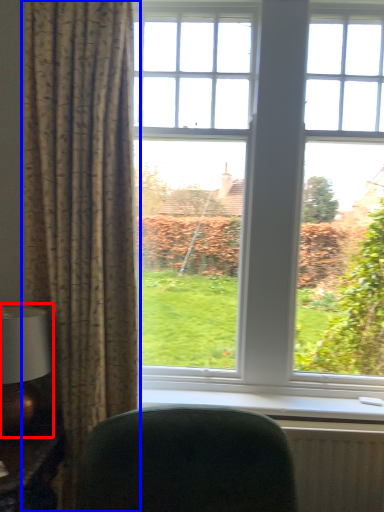
Question: Which object is further to the camera taking this photo, table lamp (highlighted by a red box) or curtain (highlighted by a blue box)?

Choices:
 (A) table lamp
 (B) curtain

Answer: (B)